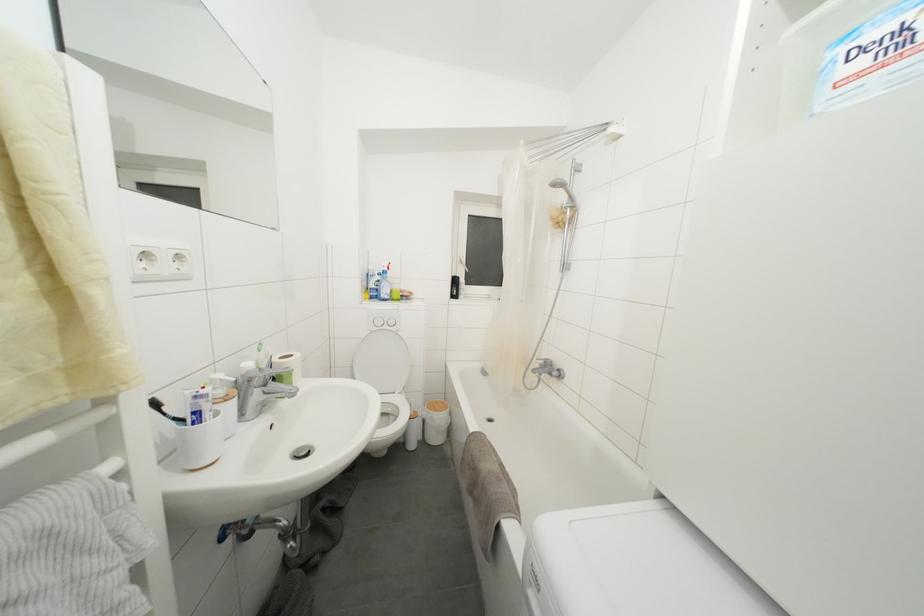
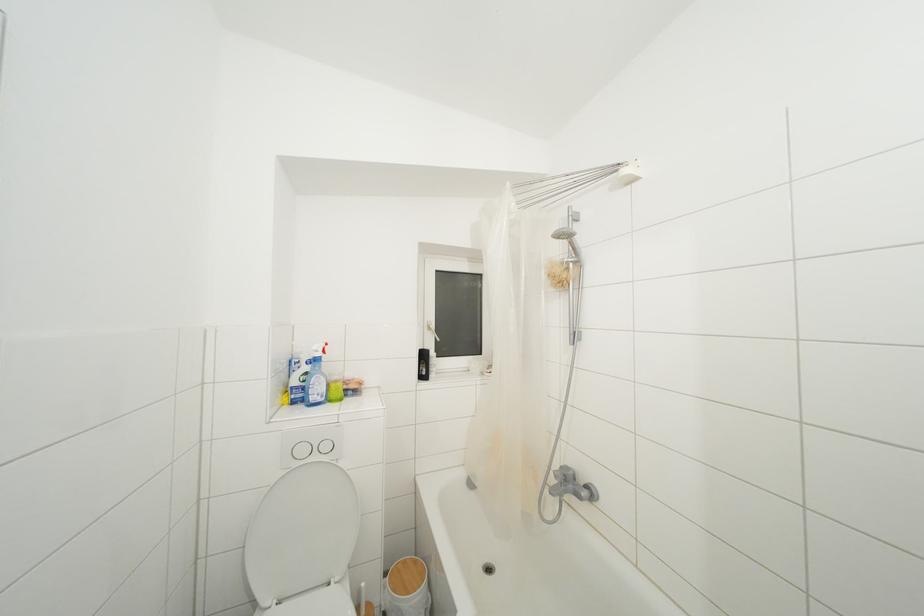
In the second image, find the point that corresponds to pixel 458 286 in the first image.

(428, 361)